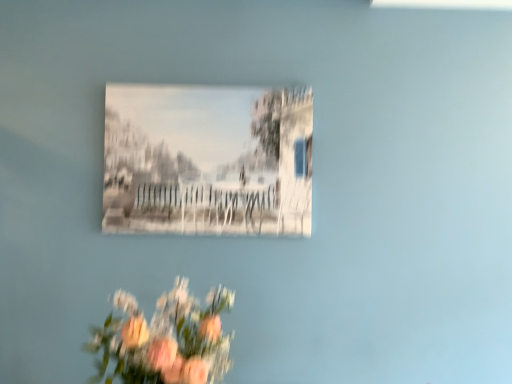
Locate an element on the screen. The width and height of the screenshot is (512, 384). pink matte flowers at lower center is located at coordinates (165, 339).

What do you see at coordinates (165, 339) in the screenshot?
I see `pink matte flowers at lower center` at bounding box center [165, 339].

Where is `pink matte flowers at lower center`? This screenshot has width=512, height=384. pink matte flowers at lower center is located at coordinates (165, 339).